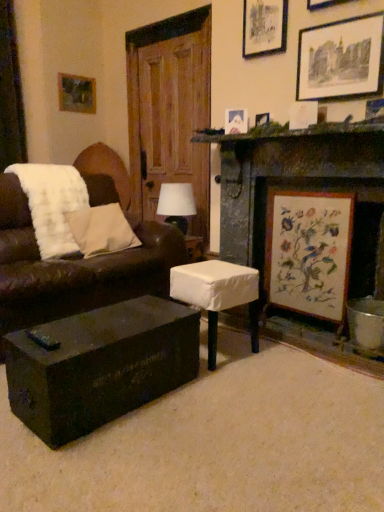
Identify the location of free spot to the right of matte black trunk at lower center. Image resolution: width=384 pixels, height=512 pixels. (234, 412).